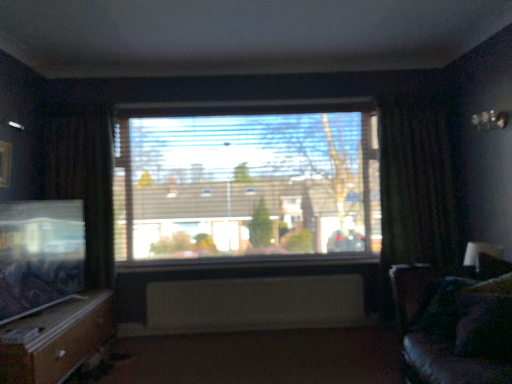
Question: Is white painted wood at center positioned behind white textured radiator at center?

Choices:
 (A) yes
 (B) no

Answer: (A)

Question: Is white painted wood at center closer to camera compared to white textured radiator at center?

Choices:
 (A) yes
 (B) no

Answer: (B)

Question: Does white painted wood at center contain white textured radiator at center?

Choices:
 (A) yes
 (B) no

Answer: (B)

Question: Are white painted wood at center and white textured radiator at center beside each other?

Choices:
 (A) yes
 (B) no

Answer: (B)

Question: Is white painted wood at center far from white textured radiator at center?

Choices:
 (A) yes
 (B) no

Answer: (B)

Question: In terms of width, does wooden drawer at lower left look wider or thinner when compared to dark brown fabric curtain at left, which is the 1th curtain from left to right?

Choices:
 (A) thin
 (B) wide

Answer: (B)

Question: Do you think wooden drawer at lower left is within dark brown fabric curtain at left, which is counted as the 2th curtain, starting from the right, or outside of it?

Choices:
 (A) inside
 (B) outside

Answer: (B)

Question: From the image's perspective, is wooden drawer at lower left above or below dark brown fabric curtain at left, which is counted as the 2th curtain, starting from the right?

Choices:
 (A) above
 (B) below

Answer: (B)

Question: Does point (48, 372) appear closer or farther from the camera than point (95, 162)?

Choices:
 (A) closer
 (B) farther

Answer: (A)

Question: Looking at the image, does velvet dark brown couch at right seem bigger or smaller compared to transparent glass window at center?

Choices:
 (A) small
 (B) big

Answer: (A)

Question: Considering the relative positions of velvet dark brown couch at right and transparent glass window at center in the image provided, is velvet dark brown couch at right to the left or to the right of transparent glass window at center?

Choices:
 (A) left
 (B) right

Answer: (B)

Question: Is point (412, 365) closer or farther from the camera than point (198, 132)?

Choices:
 (A) farther
 (B) closer

Answer: (B)

Question: From a real-world perspective, is velvet dark brown couch at right physically located above or below transparent glass window at center?

Choices:
 (A) above
 (B) below

Answer: (B)

Question: Considering the positions of wooden drawer at lower left and dark fabric curtain at right, the first curtain viewed from the right, in the image, is wooden drawer at lower left taller or shorter than dark fabric curtain at right, the first curtain viewed from the right,?

Choices:
 (A) tall
 (B) short

Answer: (B)

Question: Is wooden drawer at lower left wider or thinner than dark fabric curtain at right, the 2th curtain in the left-to-right sequence?

Choices:
 (A) wide
 (B) thin

Answer: (A)